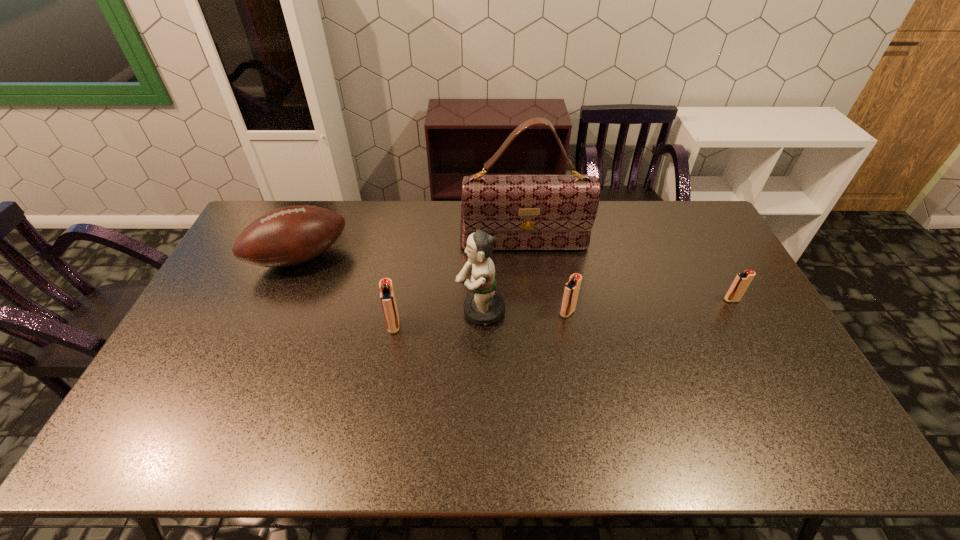
Where is `the fifth object from right to left`? Image resolution: width=960 pixels, height=540 pixels. the fifth object from right to left is located at coordinates (387, 296).

I want to click on the second igniter from right to left, so click(571, 290).

The image size is (960, 540). I want to click on the second tallest igniter, so click(571, 290).

The width and height of the screenshot is (960, 540). Find the location of `the rightmost igniter`. the rightmost igniter is located at coordinates (741, 282).

Where is `the farthest igniter`? the farthest igniter is located at coordinates (741, 282).

The image size is (960, 540). Identify the location of football (American). (288, 236).

Image resolution: width=960 pixels, height=540 pixels. I want to click on handbag, so click(x=524, y=212).

At what (x,y) coordinates should I click in order to perform the action: click on the second tallest object. Please return your answer as a coordinate pair (x, y). Looking at the image, I should click on (484, 306).

Locate an element on the screen. Image resolution: width=960 pixels, height=540 pixels. free space located 0.250m on the left of the leftmost igniter is located at coordinates (302, 326).

Locate an element on the screen. This screenshot has height=540, width=960. vacant area located on the left of the second shortest igniter is located at coordinates (519, 313).